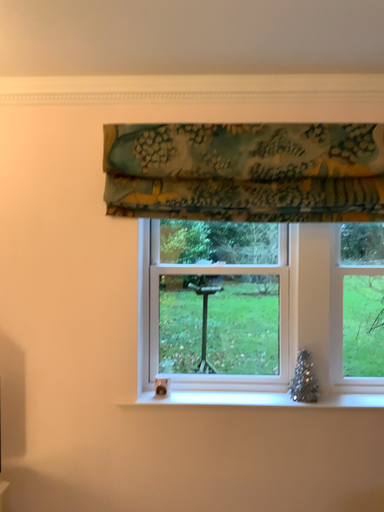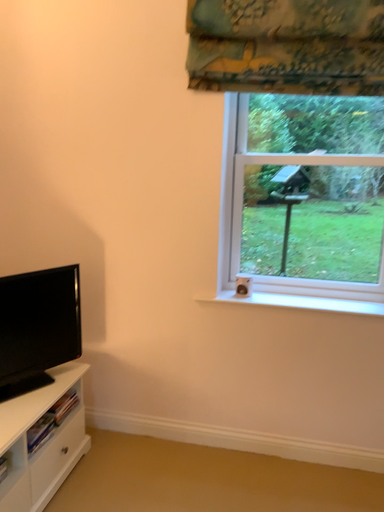
Question: Which way did the camera rotate in the video?

Choices:
 (A) rotated upward
 (B) rotated downward

Answer: (B)